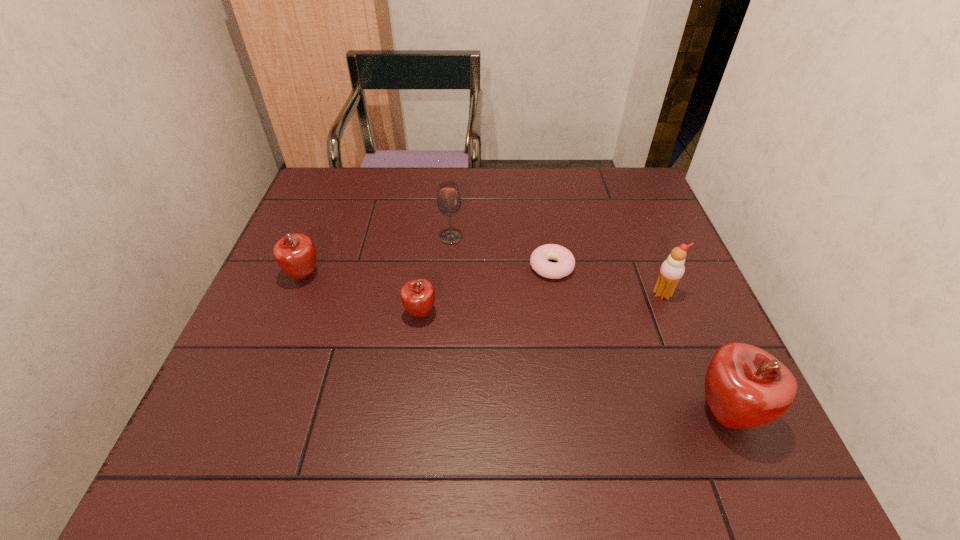
The width and height of the screenshot is (960, 540). Find the location of `the leftmost object`. the leftmost object is located at coordinates (295, 253).

Image resolution: width=960 pixels, height=540 pixels. I want to click on the second shortest apple, so click(295, 253).

You are a GUI agent. You are given a task and a screenshot of the screen. Output one action in this format:
    pyautogui.click(x=<x>, y=<y>)
    Task: Click on the second shortest object
    The height and width of the screenshot is (540, 960).
    Given the screenshot: What is the action you would take?
    pyautogui.click(x=417, y=296)

Where is `the second nearest apple`? The width and height of the screenshot is (960, 540). the second nearest apple is located at coordinates (417, 296).

Where is `the rightmost apple`? The image size is (960, 540). the rightmost apple is located at coordinates (745, 386).

Find the location of a particular element. The width and height of the screenshot is (960, 540). the nearest object is located at coordinates (745, 386).

The width and height of the screenshot is (960, 540). Find the location of `icecream`. icecream is located at coordinates (672, 270).

You are a GUI agent. You are given a task and a screenshot of the screen. Output one action in this format:
    pyautogui.click(x=<x>, y=<y>)
    Task: Click on the glass drink container
    
    Given the screenshot: What is the action you would take?
    pyautogui.click(x=448, y=198)

Identify the location of the third object from right to left. (539, 258).

I want to click on the shortest object, so click(539, 258).